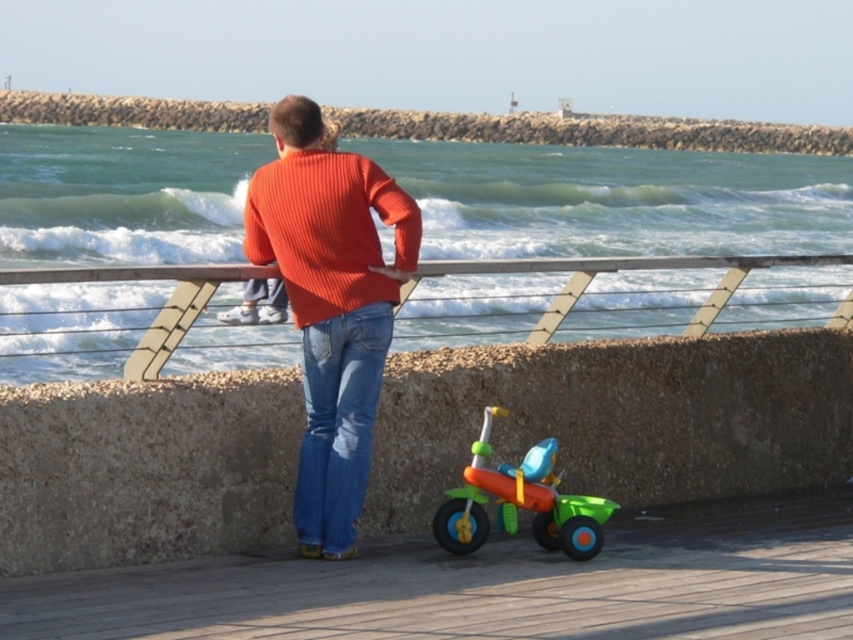
Identify the location of blue denim jeans at center. (338, 422).

Describe the element at coordinates (338, 422) in the screenshot. I see `blue denim jeans at center` at that location.

Locate an element on the screen. The height and width of the screenshot is (640, 853). blue denim jeans at center is located at coordinates (338, 422).

You are a GUI agent. You are given a task and a screenshot of the screen. Output one action in this format:
    pyautogui.click(x=<x>, y=<y>)
    Task: Click on the blue denim jeans at center
    
    Given the screenshot: What is the action you would take?
    pyautogui.click(x=338, y=422)

Is brushed concrete wall at upper center taller than metallic gray rail at center?

Yes.

This screenshot has width=853, height=640. I want to click on brushed concrete wall at upper center, so click(x=596, y=131).

Between point (323, 602) and point (833, 136), which one is positioned behind?

The point (833, 136) is more distant.

Is point (125, 627) less distant than point (265, 116)?

Yes.

Where is `wooden dock at lower center`? The height and width of the screenshot is (640, 853). wooden dock at lower center is located at coordinates (490, 584).